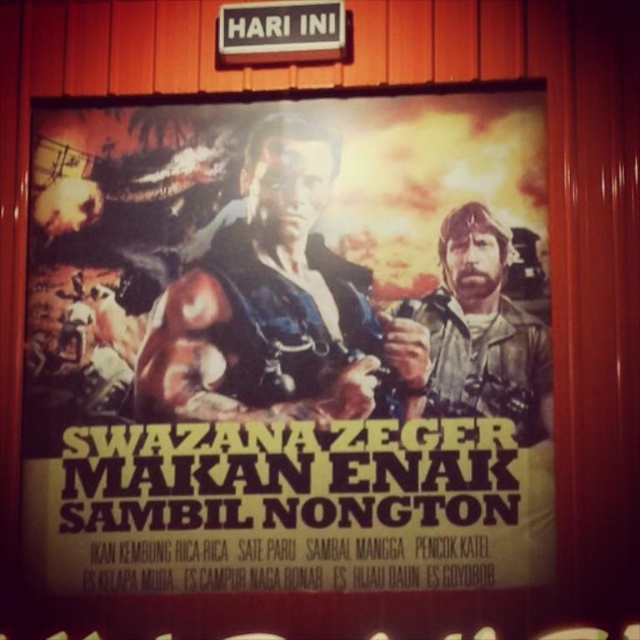
Which is more to the right, matte paper poster at center or metallic sign at upper center?

metallic sign at upper center

Can you confirm if matte paper poster at center is positioned to the right of metallic sign at upper center?

Incorrect, matte paper poster at center is not on the right side of metallic sign at upper center.

Does point (260, 120) come behind point (252, 32)?

Yes, point (260, 120) is farther from viewer.

Identify the location of matte paper poster at center. (289, 342).